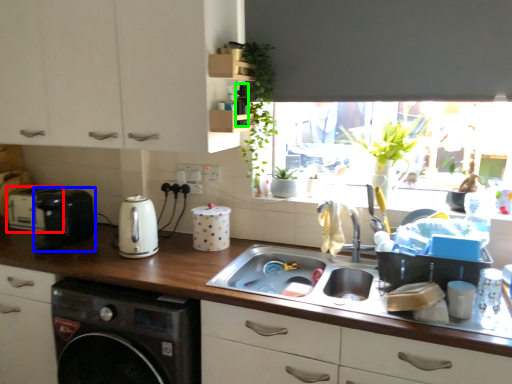
Question: Which object is the farthest from appliance (highlighted by a red box)? Choose among these: appliance (highlighted by a blue box) or bottle (highlighted by a green box).

Choices:
 (A) appliance
 (B) bottle

Answer: (B)